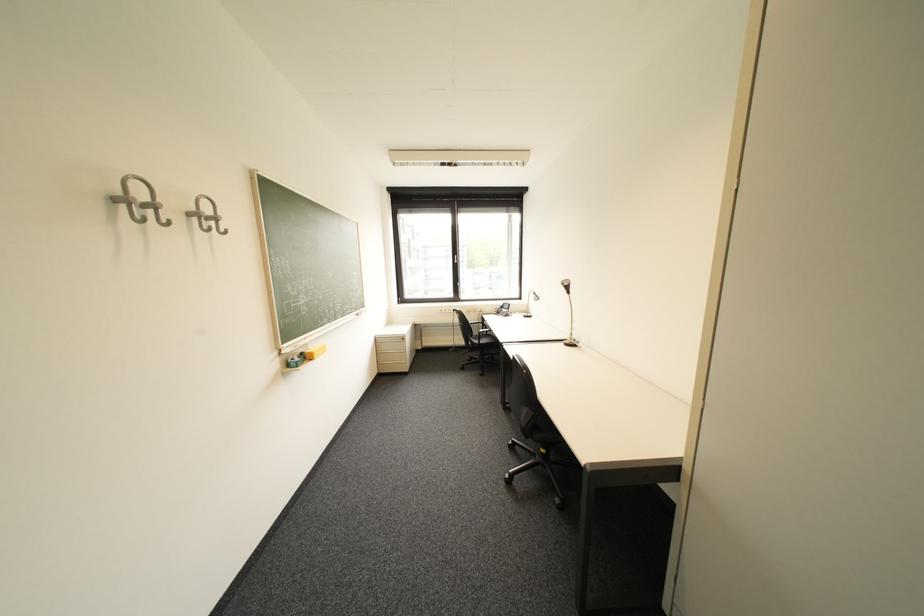
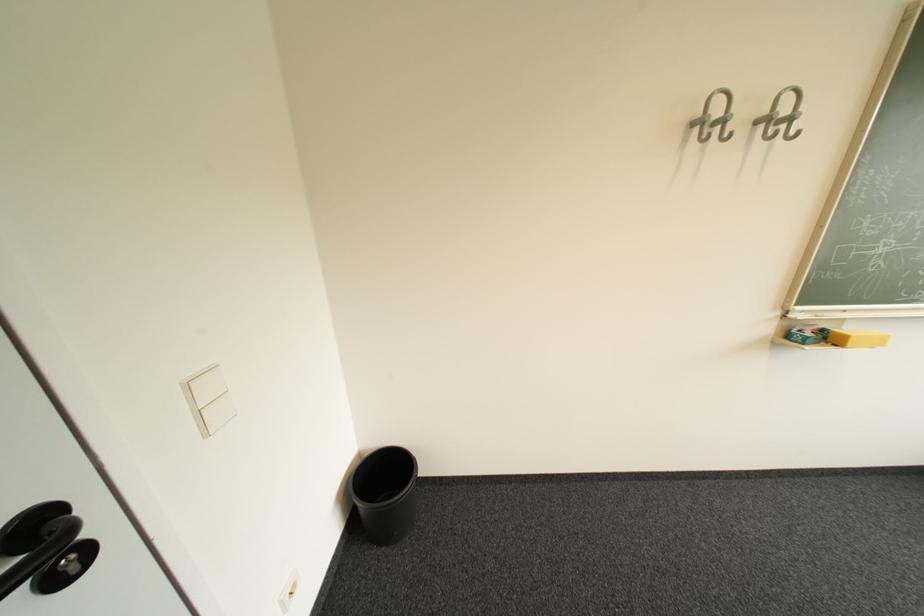
Locate, in the second image, the point that corresponds to [203,209] in the first image.

(775, 113)